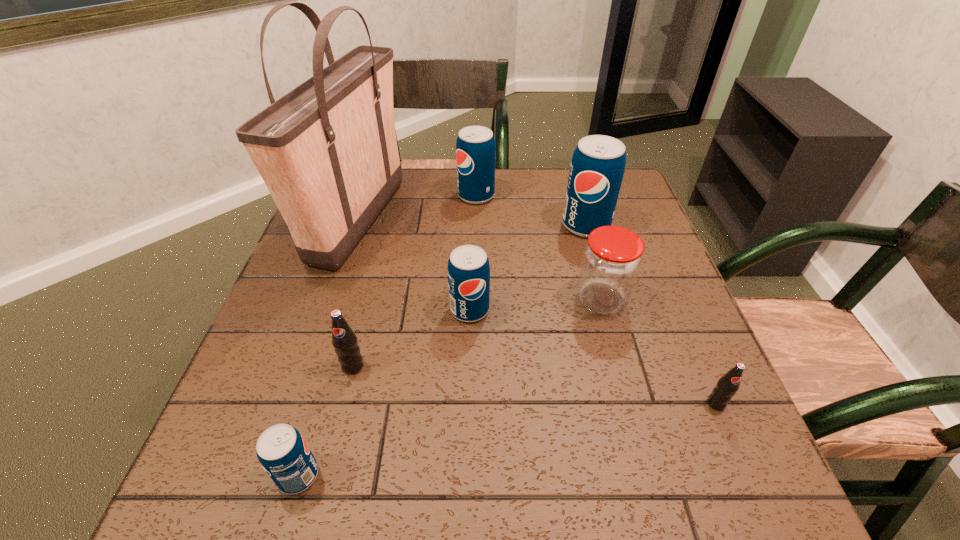
This screenshot has width=960, height=540. I want to click on the smaller black pop, so click(x=727, y=386).

Where is `the second nearest pop`? the second nearest pop is located at coordinates (727, 386).

Find the location of a particular element. This screenshot has width=960, height=540. the nearest object is located at coordinates (282, 451).

The height and width of the screenshot is (540, 960). I want to click on the smallest blue pop, so click(282, 451).

Locate an element on the screen. The image size is (960, 540). free space located on the front of the shopping bag is located at coordinates (291, 430).

Where is `vacant space located on the front of the biggest blue pop`? The image size is (960, 540). vacant space located on the front of the biggest blue pop is located at coordinates (598, 269).

The image size is (960, 540). In order to click on free point located 0.050m on the left of the farthest pop in this screenshot , I will do click(441, 195).

The image size is (960, 540). I want to click on blank area located 0.220m on the front of the red jar, so click(x=631, y=413).

Where is `vacant space situated 0.140m on the right of the fourth nearest pop`? vacant space situated 0.140m on the right of the fourth nearest pop is located at coordinates (553, 309).

In order to click on vacant position located on the front label of the farther black pop in this screenshot , I will do point(344,403).